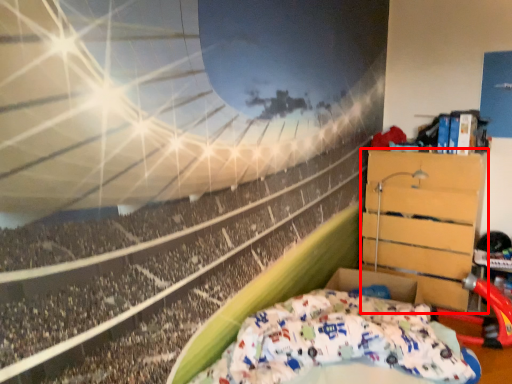
Question: From the image's perspective, where is furniture (annotated by the red box) located in relation to bed in the image?

Choices:
 (A) below
 (B) above

Answer: (B)